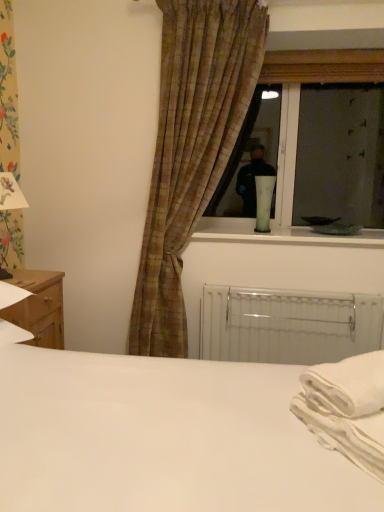
Question: Can you confirm if plaid fabric curtain at center is thinner than wooden nightstand at lower left?

Choices:
 (A) yes
 (B) no

Answer: (A)

Question: Is plaid fabric curtain at center facing away from wooden nightstand at lower left?

Choices:
 (A) no
 (B) yes

Answer: (A)

Question: Is plaid fabric curtain at center to the right of wooden nightstand at lower left from the viewer's perspective?

Choices:
 (A) yes
 (B) no

Answer: (A)

Question: Considering the relative positions of plaid fabric curtain at center and wooden nightstand at lower left in the image provided, is plaid fabric curtain at center behind wooden nightstand at lower left?

Choices:
 (A) no
 (B) yes

Answer: (B)

Question: Would you say wooden nightstand at lower left is part of plaid fabric curtain at center's contents?

Choices:
 (A) no
 (B) yes

Answer: (A)

Question: Is plaid fabric curtain at center positioned in front of wooden nightstand at lower left?

Choices:
 (A) no
 (B) yes

Answer: (A)

Question: Is white matte bed at center at the left side of white metallic radiator at lower center?

Choices:
 (A) yes
 (B) no

Answer: (A)

Question: Could you tell me if white matte bed at center is facing white metallic radiator at lower center?

Choices:
 (A) yes
 (B) no

Answer: (B)

Question: From the image's perspective, would you say white matte bed at center is shown under white metallic radiator at lower center?

Choices:
 (A) no
 (B) yes

Answer: (A)

Question: From a real-world perspective, is white matte bed at center physically above white metallic radiator at lower center?

Choices:
 (A) no
 (B) yes

Answer: (B)

Question: Considering the relative positions of white matte bed at center and white metallic radiator at lower center in the image provided, is white matte bed at center to the right of white metallic radiator at lower center from the viewer's perspective?

Choices:
 (A) no
 (B) yes

Answer: (A)

Question: Considering the relative sizes of white matte bed at center and white metallic radiator at lower center in the image provided, is white matte bed at center taller than white metallic radiator at lower center?

Choices:
 (A) yes
 (B) no

Answer: (A)

Question: Is plaid fabric curtain at center oriented away from green glass vase at window, marked as the 1th table lamp in a back-to-front arrangement?

Choices:
 (A) yes
 (B) no

Answer: (A)